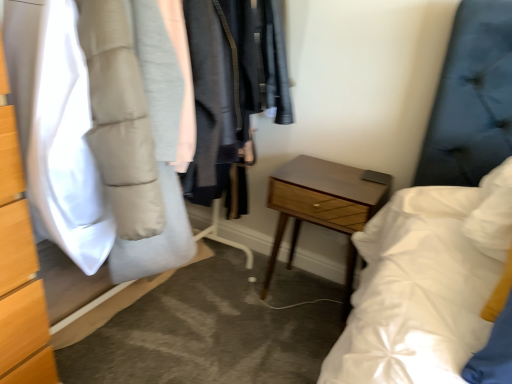
Question: Is matte gray puffer jacket at left wider than white matte puffer jacket at left?

Choices:
 (A) no
 (B) yes

Answer: (B)

Question: Is matte gray puffer jacket at left facing towards white matte puffer jacket at left?

Choices:
 (A) yes
 (B) no

Answer: (A)

Question: Is white matte puffer jacket at left inside matte gray puffer jacket at left?

Choices:
 (A) yes
 (B) no

Answer: (A)

Question: Considering the relative positions of matte gray puffer jacket at left and white matte puffer jacket at left in the image provided, is matte gray puffer jacket at left in front of white matte puffer jacket at left?

Choices:
 (A) yes
 (B) no

Answer: (A)

Question: Is matte gray puffer jacket at left far from white matte puffer jacket at left?

Choices:
 (A) no
 (B) yes

Answer: (A)

Question: Is white matte puffer jacket at left wider or thinner than woodenmaterial/texturenightstand at center?

Choices:
 (A) thin
 (B) wide

Answer: (B)

Question: From a real-world perspective, is white matte puffer jacket at left positioned above or below woodenmaterial/texturenightstand at center?

Choices:
 (A) above
 (B) below

Answer: (A)

Question: From the image's perspective, is white matte puffer jacket at left located above or below woodenmaterial/texturenightstand at center?

Choices:
 (A) above
 (B) below

Answer: (A)

Question: Would you say white matte puffer jacket at left is inside or outside woodenmaterial/texturenightstand at center?

Choices:
 (A) inside
 (B) outside

Answer: (B)

Question: Is white matte puffer jacket at left in front of or behind matte gray puffer jacket at left in the image?

Choices:
 (A) behind
 (B) front

Answer: (A)

Question: Is white matte puffer jacket at left wider or thinner than matte gray puffer jacket at left?

Choices:
 (A) wide
 (B) thin

Answer: (B)

Question: Looking at the image, does white matte puffer jacket at left seem bigger or smaller compared to matte gray puffer jacket at left?

Choices:
 (A) big
 (B) small

Answer: (B)

Question: In terms of height, does white matte puffer jacket at left look taller or shorter compared to matte gray puffer jacket at left?

Choices:
 (A) short
 (B) tall

Answer: (A)

Question: Visually, is matte gray puffer jacket at left positioned to the left or to the right of white matte puffer jacket at left?

Choices:
 (A) left
 (B) right

Answer: (B)

Question: From the image's perspective, is matte gray puffer jacket at left positioned above or below white matte puffer jacket at left?

Choices:
 (A) above
 (B) below

Answer: (B)